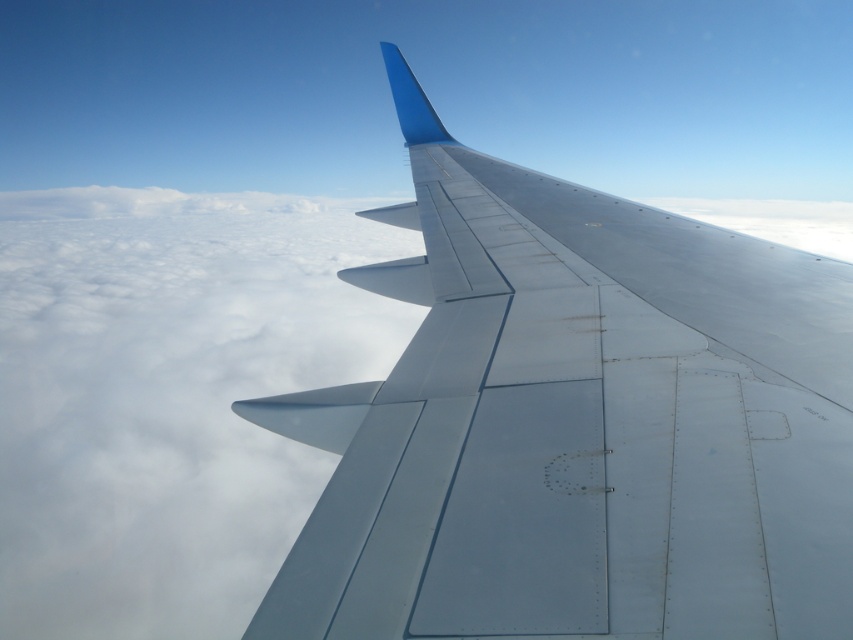
Question: Can you confirm if metallic gray wing at center is thinner than white fluffy cloud at upper left?

Choices:
 (A) no
 (B) yes

Answer: (B)

Question: Does metallic gray wing at center have a greater width compared to white fluffy cloud at upper left?

Choices:
 (A) yes
 (B) no

Answer: (B)

Question: Which point is farther to the camera?

Choices:
 (A) (643, 456)
 (B) (80, 568)

Answer: (B)

Question: Which point is farther to the camera?

Choices:
 (A) metallic gray wing at center
 (B) white fluffy cloud at upper left

Answer: (A)

Question: Can you confirm if metallic gray wing at center is positioned to the right of white fluffy cloud at upper left?

Choices:
 (A) no
 (B) yes

Answer: (B)